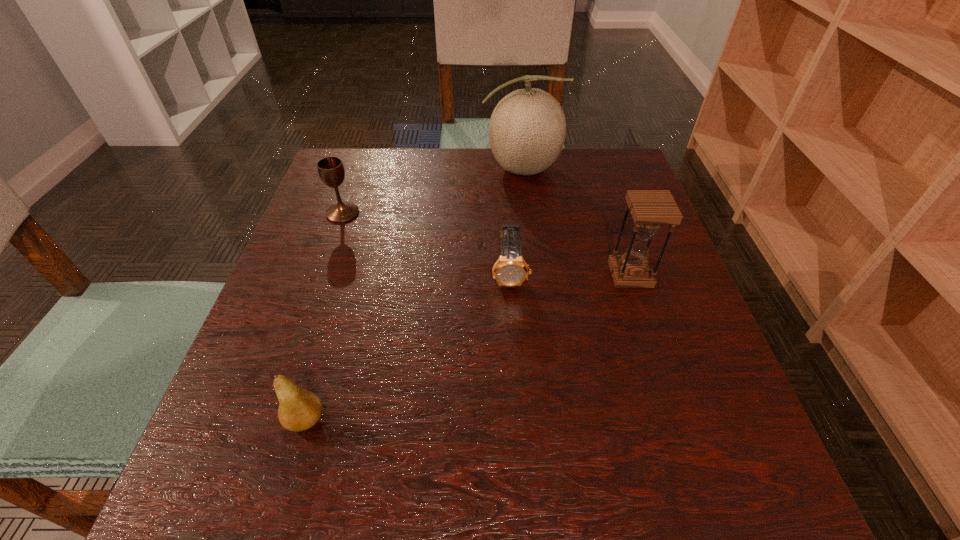
Identify the location of blank region between the hourglass and the chalice. (487, 244).

The image size is (960, 540). Identify the location of empty space between the tallest object and the pear. pos(414,294).

The height and width of the screenshot is (540, 960). Identify the location of object that is the nearest to the watch. (651, 209).

You are a GUI agent. You are given a task and a screenshot of the screen. Output one action in this format:
    pyautogui.click(x=<x>, y=<y>)
    Task: Click on the object that stands as the fourth closest to the chalice
    Image resolution: width=960 pixels, height=540 pixels.
    Given the screenshot: What is the action you would take?
    pyautogui.click(x=651, y=209)

Locate an element on the screen. Image resolution: width=960 pixels, height=540 pixels. vacant space that satisfies the following two spatial constraints: 1. on the front side of the chalice; 2. on the left side of the rightmost object is located at coordinates (322, 274).